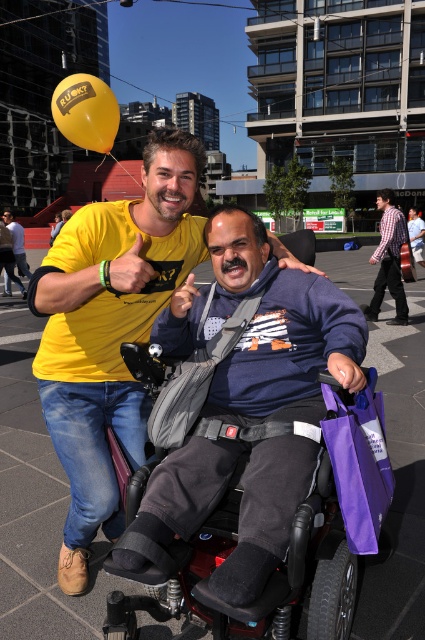
Is purple fabric bag at lower right wider than plaid cotton shirt at center?

No.

Is point (348, 476) closer to viewer compared to point (405, 232)?

That is True.

You are a GUI agent. You are given a task and a screenshot of the screen. Output one action in this format:
    pyautogui.click(x=<x>, y=<y>)
    Task: Click on the purple fabric bag at lower right
    
    Given the screenshot: What is the action you would take?
    pyautogui.click(x=357, y=460)

Between matte yellow t-shirt at upper left and yellow t-shirt at center, which one is positioned higher?

yellow t-shirt at center is above.

Locate an element on the screen. matte yellow t-shirt at upper left is located at coordinates (110, 330).

Identify the location of matte yellow t-shirt at upper left. (110, 330).

Does plaid cotton shirt at center have a lesser width compared to blue denim jeans at center?

Yes.

Which of these two, plaid cotton shirt at center or blue denim jeans at center, stands taller?

Standing taller between the two is plaid cotton shirt at center.

This screenshot has height=640, width=425. What do you see at coordinates (388, 259) in the screenshot?
I see `plaid cotton shirt at center` at bounding box center [388, 259].

Find the location of a particular element. plaid cotton shirt at center is located at coordinates (388, 259).